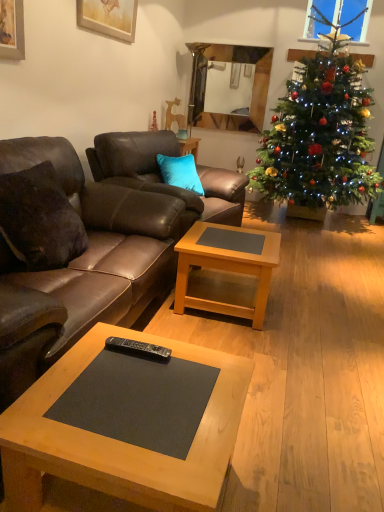
Find the location of a particular element. This screenshot has width=384, height=512. free spot in front of green matte christmas tree at right is located at coordinates (x=327, y=252).